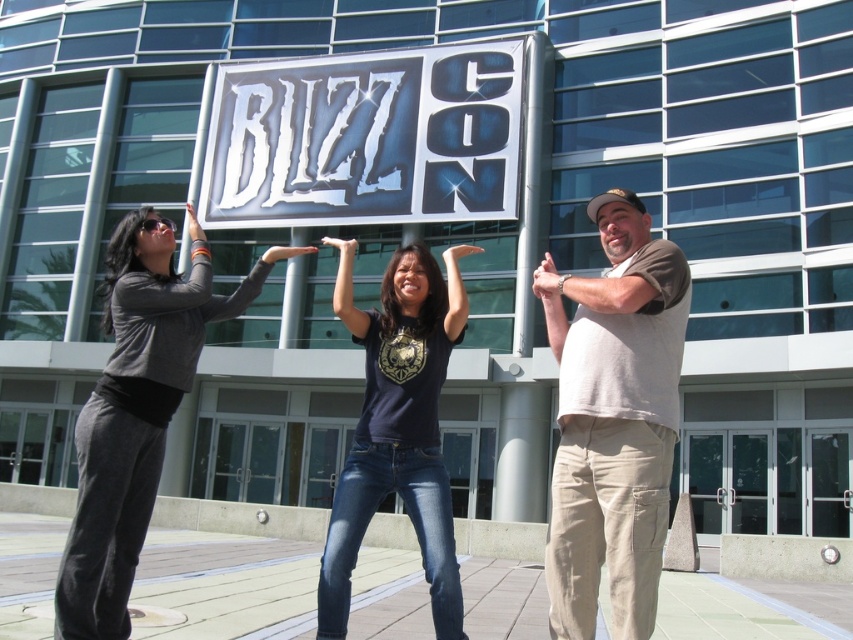
Question: Does metallic silver sign at center appear on the right side of matte black shirt at center?

Choices:
 (A) no
 (B) yes

Answer: (A)

Question: Can you confirm if beige cotton pants at right is positioned above black matte t-shirt at center?

Choices:
 (A) no
 (B) yes

Answer: (A)

Question: Can you confirm if metallic silver sign at center is smaller than beige cotton pants at right?

Choices:
 (A) yes
 (B) no

Answer: (B)

Question: Which of the following is the closest to the observer?

Choices:
 (A) (463, 298)
 (B) (241, 145)
 (C) (619, 266)
 (D) (132, 380)

Answer: (D)

Question: Among these points, which one is farthest from the camera?

Choices:
 (A) (619, 547)
 (B) (349, 589)
 (C) (376, 438)
 (D) (91, 536)

Answer: (C)

Question: Which of the following is the farthest from the observer?

Choices:
 (A) metallic silver sign at center
 (B) dark gray sweatshirt at left
 (C) black matte t-shirt at center

Answer: (A)